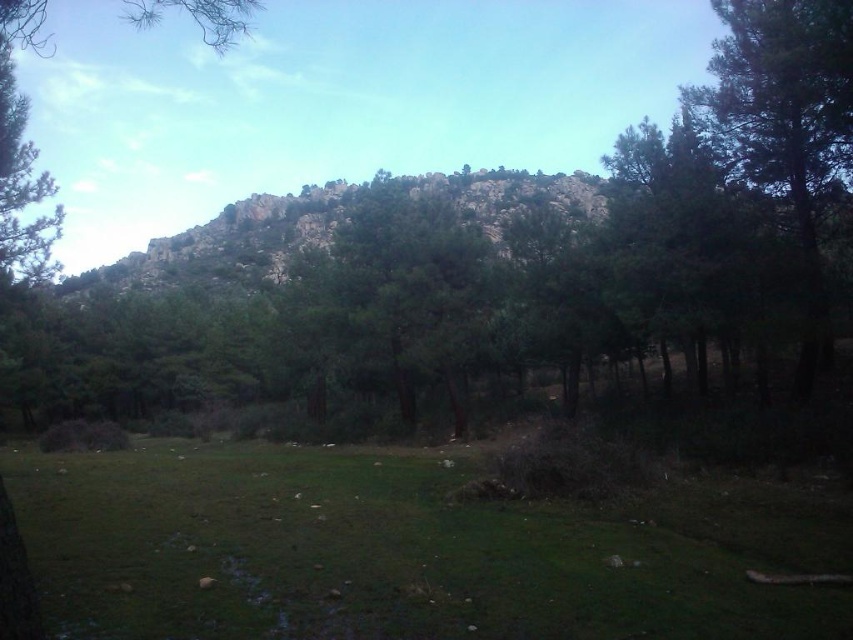
Question: Which point is farther to the camera?

Choices:
 (A) green grassy field at lower left
 (B) green textured tree at center

Answer: (B)

Question: Is green grassy field at lower left further to the viewer compared to green textured tree at center?

Choices:
 (A) yes
 (B) no

Answer: (B)

Question: From the image, what is the correct spatial relationship of green grassy field at lower left in relation to green textured tree at center?

Choices:
 (A) left
 (B) right

Answer: (B)

Question: Which of the following is the closest to the observer?

Choices:
 (A) green textured tree at center
 (B) green grassy field at lower left

Answer: (B)

Question: Does green grassy field at lower left appear on the right side of green textured tree at center?

Choices:
 (A) no
 (B) yes

Answer: (B)